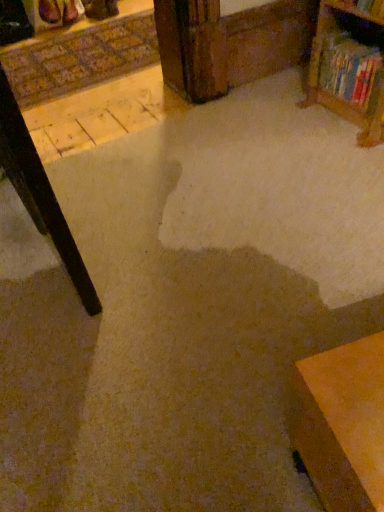
Question: Is hardcover book at upper right situated inside wooden bookshelf at upper right or outside?

Choices:
 (A) outside
 (B) inside

Answer: (A)

Question: From the image's perspective, relative to wooden bookshelf at upper right, is hardcover book at upper right above or below?

Choices:
 (A) below
 (B) above

Answer: (A)

Question: Is hardcover book at upper right wider or thinner than wooden bookshelf at upper right?

Choices:
 (A) wide
 (B) thin

Answer: (A)

Question: Does point (382, 20) appear closer or farther from the camera than point (360, 69)?

Choices:
 (A) closer
 (B) farther

Answer: (A)

Question: From the image's perspective, is wooden bookshelf at upper right positioned above or below hardcover book at upper right?

Choices:
 (A) above
 (B) below

Answer: (A)

Question: Based on their sizes in the image, would you say wooden bookshelf at upper right is bigger or smaller than hardcover book at upper right?

Choices:
 (A) big
 (B) small

Answer: (B)

Question: In terms of height, does wooden bookshelf at upper right look taller or shorter compared to hardcover book at upper right?

Choices:
 (A) tall
 (B) short

Answer: (B)